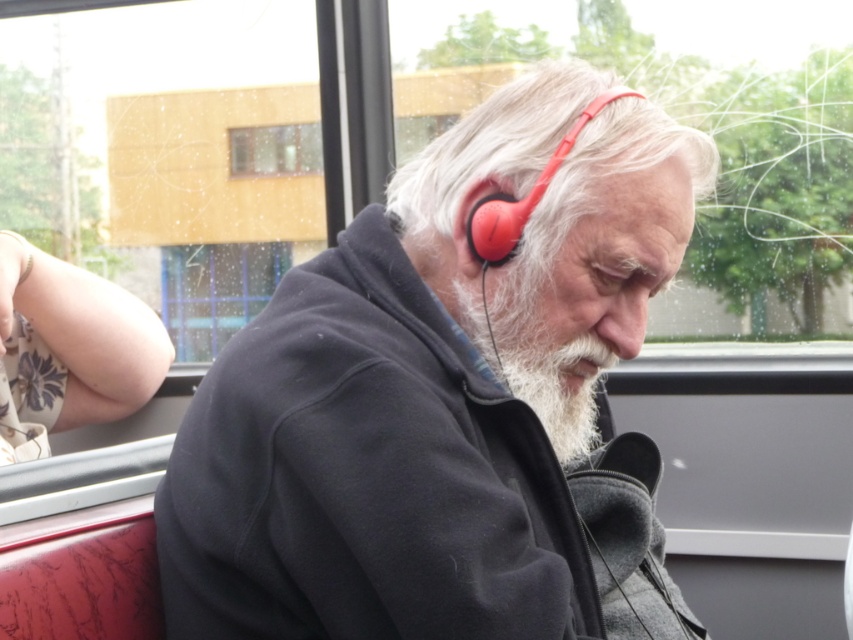
Question: Among these objects, which one is nearest to the camera?

Choices:
 (A) clear glass window at upper center
 (B) white matte hair at center

Answer: (B)

Question: Does blue glass window at upper center have a greater width compared to clear glass window at upper center?

Choices:
 (A) yes
 (B) no

Answer: (A)

Question: Can you confirm if white soft beard at center is bigger than matte red earphone at upper center?

Choices:
 (A) no
 (B) yes

Answer: (B)

Question: Is matte black headphones at center below blue glass window at upper center?

Choices:
 (A) yes
 (B) no

Answer: (A)

Question: Which object is closer to the camera taking this photo?

Choices:
 (A) white matte hair at center
 (B) matte red earphone at upper center
 (C) clear glass window at upper center

Answer: (A)

Question: Which point is closer to the camera?

Choices:
 (A) matte red earphone at upper center
 (B) white soft beard at center

Answer: (A)